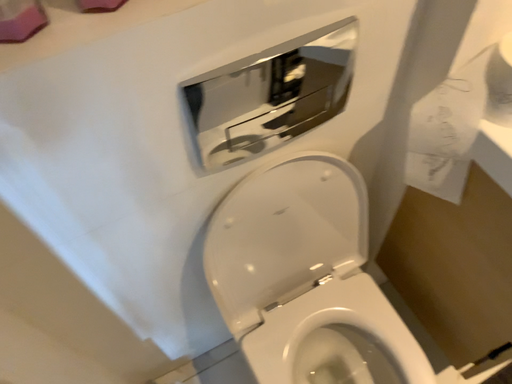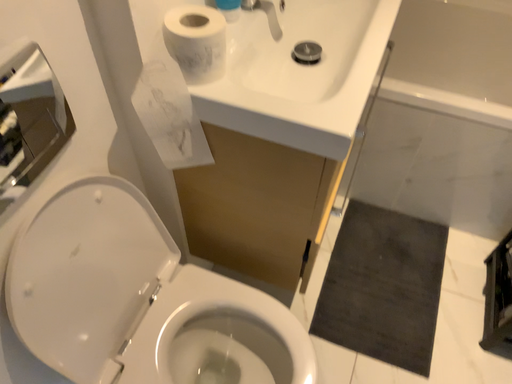
Question: Which way did the camera rotate in the video?

Choices:
 (A) rotated upward
 (B) rotated downward

Answer: (A)